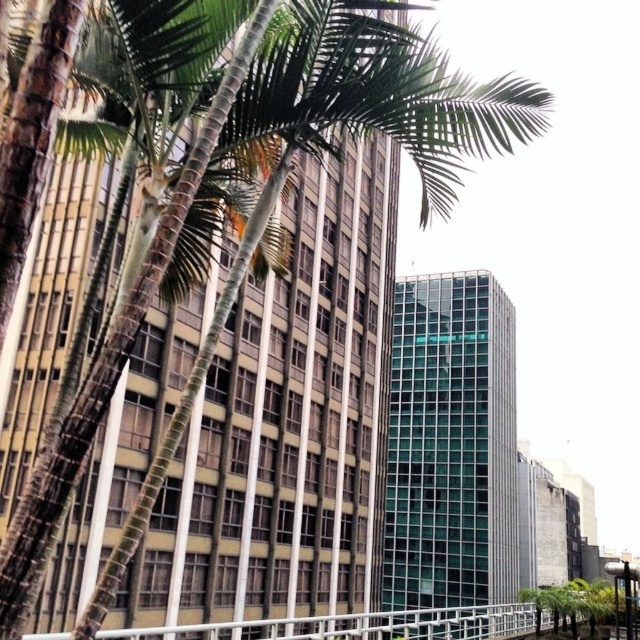
Where is `white metal rail at lower center`? Image resolution: width=640 pixels, height=640 pixels. white metal rail at lower center is located at coordinates (356, 625).

Is point (180, 630) less distant than point (596, 614)?

Yes.

This screenshot has width=640, height=640. Identify the location of white metal rail at lower center. (356, 625).

At what (x,y) coordinates should I click in order to perform the action: click on white metal rail at lower center. Please return your answer as a coordinate pair (x, y). Looking at the image, I should click on (356, 625).